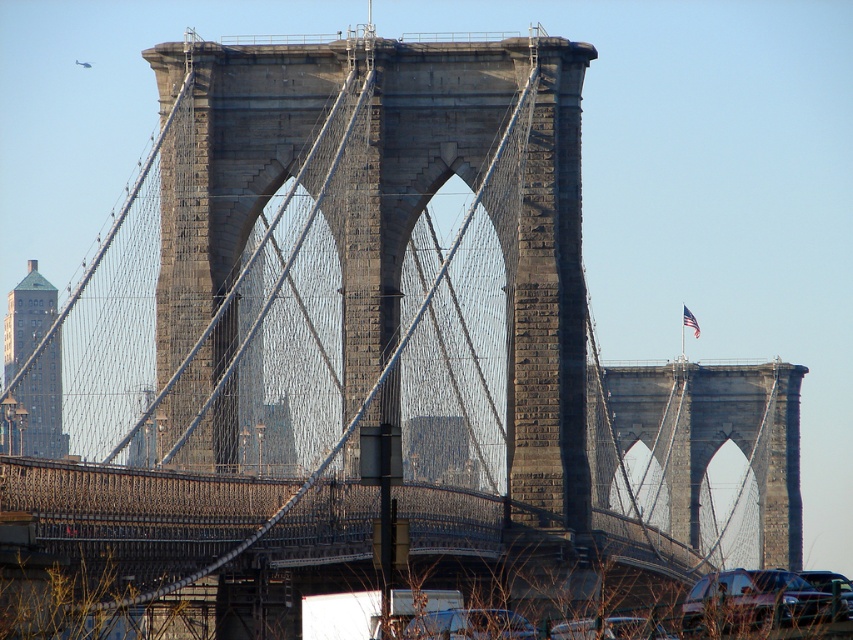
You are a photographer standing at the base of the Brooklyn Bridge. You notice two vehicles in the foreground, a shiny black sedan at lower right and a shiny black car at lower center. Which vehicle appears taller in the photo?

The shiny black sedan at lower right appears taller in the photo because it has a greater height compared to the shiny black car at lower center.

You are a delivery driver who needs to pick up a package from a metallic silver car located at the lower center of the image. The coordinates provided are point (469, 625). Can you confirm if this point is indeed on the metallic silver car at lower center?

Yes, the point (469, 625) is on the metallic silver car at lower center as stated in the objects description.

You are a pedestrian standing on the sidewalk near the Brooklyn Bridge. You see a shiny black sedan at lower right and a metallic silver car at lower center. Which car is closer to you?

The shiny black sedan at lower right is closer to you because it is in front of the metallic silver car at lower center.